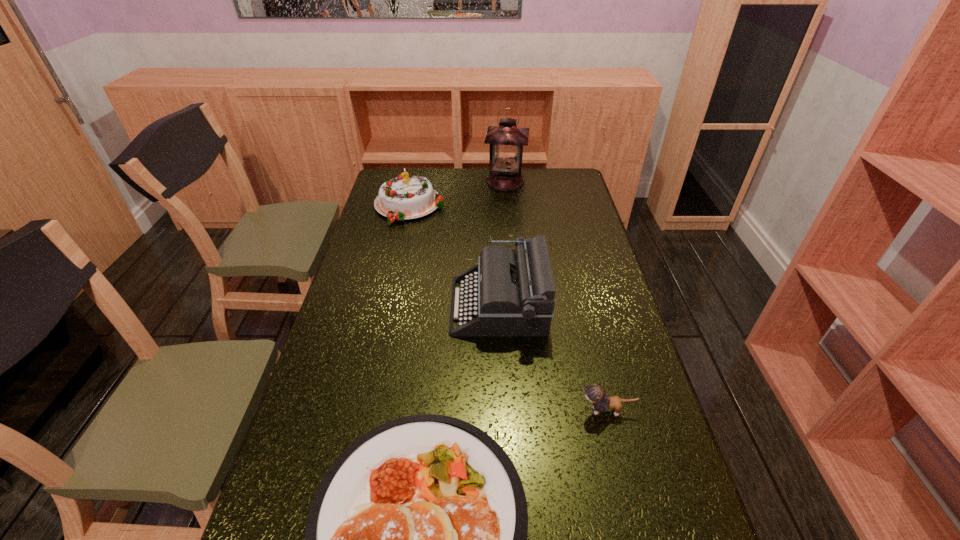
You are a GUI agent. You are given a task and a screenshot of the screen. Output one action in this format:
    pyautogui.click(x=<x>, y=<y>)
    Task: Click on the vacant region located 0.130m on the front-facing side of the second shortest object
    The image size is (960, 540).
    Given the screenshot: What is the action you would take?
    pyautogui.click(x=527, y=411)

Where is `blank area located on the front-facing side of the second shortest object`? The width and height of the screenshot is (960, 540). blank area located on the front-facing side of the second shortest object is located at coordinates (436, 411).

At what (x,y) coordinates should I click in order to perform the action: click on vacant space located 0.370m on the front-facing side of the second shortest object. Please return your answer as a coordinate pair (x, y). Image resolution: width=960 pixels, height=540 pixels. Looking at the image, I should click on tap(431, 411).

Identify the location of oil lamp that is at the far edge. (506, 141).

What are the coordinates of `cake located in the far edge section of the desktop` in the screenshot? It's located at (406, 197).

The image size is (960, 540). I want to click on object located at the left edge, so [406, 197].

You are a GUI agent. You are given a task and a screenshot of the screen. Output one action in this format:
    pyautogui.click(x=<x>, y=<y>)
    Task: Click on the object present at the right edge
    The width and height of the screenshot is (960, 540).
    Given the screenshot: What is the action you would take?
    pyautogui.click(x=595, y=394)

Locate an element on the screen. The height and width of the screenshot is (540, 960). object at the far left corner is located at coordinates (406, 197).

Identify the location of free space at the left edge. (385, 323).

Where is `vacant region at the right edge of the desktop`? The image size is (960, 540). vacant region at the right edge of the desktop is located at coordinates (569, 214).